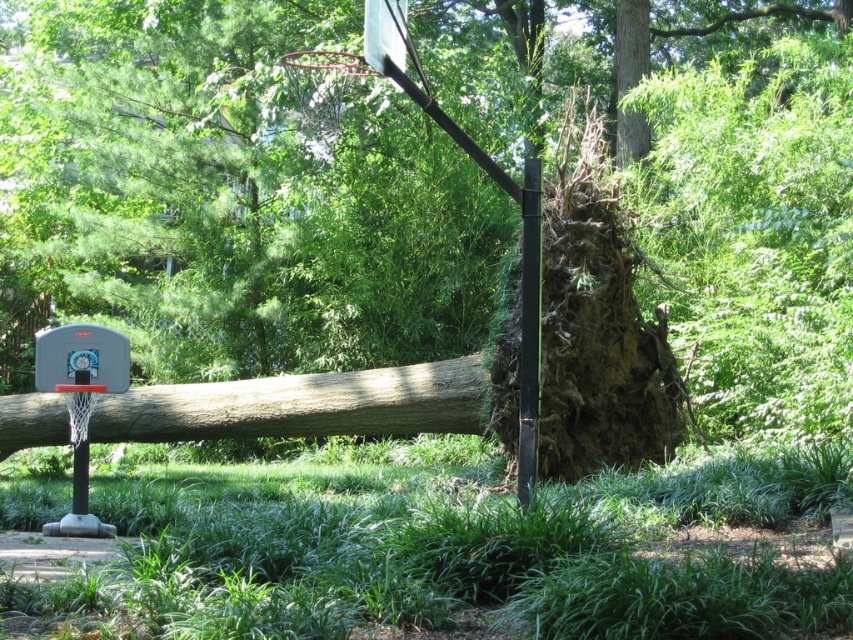
Question: Considering the relative positions of brown rough tree trunk at center and matte gray basketball hoop at left in the image provided, where is brown rough tree trunk at center located with respect to matte gray basketball hoop at left?

Choices:
 (A) below
 (B) above

Answer: (A)

Question: Can you confirm if brown rough tree trunk at center is positioned to the left of matte gray basketball hoop at left?

Choices:
 (A) yes
 (B) no

Answer: (B)

Question: Is brown rough tree trunk at center positioned behind matte gray basketball hoop at left?

Choices:
 (A) yes
 (B) no

Answer: (A)

Question: Which point is closer to the camera?

Choices:
 (A) matte gray basketball hoop at left
 (B) brown rough tree trunk at center

Answer: (A)

Question: Which point appears farthest from the camera in this image?

Choices:
 (A) (427, 428)
 (B) (74, 360)

Answer: (A)